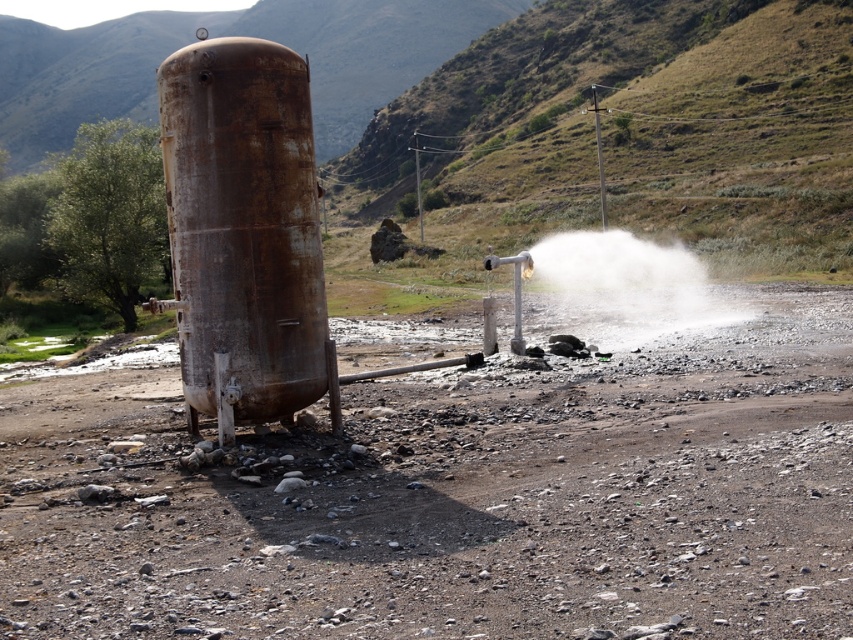
You are standing in the industrial scene and want to move from the point closer to you to the point further away. Which path would you take between the two points, point 1 at point (786,452) and point 2 at point (259,49)?

The path from point 1 at point (786,452) to point 2 at point (259,49) requires moving away from the viewer since point 1 is closer to the viewer than point 2.